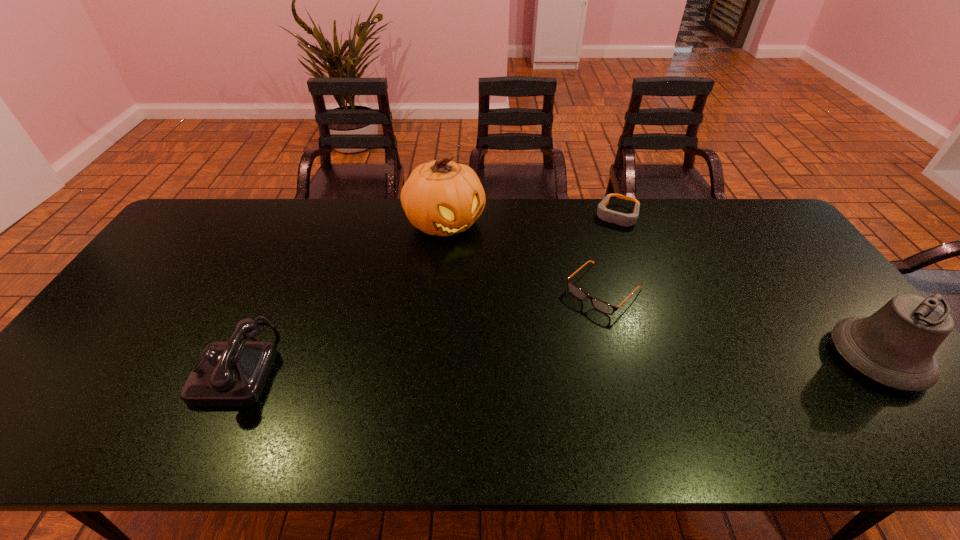
What are the coordinates of `free space on the desktop that is between the telephone and the rightmost object and is positioned on the front-facing side of the spectacles` in the screenshot? It's located at (531, 361).

Where is `vacant spot on the desktop that is between the telephone and the fourth shortest object and is positioned on the front face of the pumpkin`? vacant spot on the desktop that is between the telephone and the fourth shortest object and is positioned on the front face of the pumpkin is located at coordinates (575, 360).

The width and height of the screenshot is (960, 540). What are the coordinates of `free space on the desktop that is between the telephone and the bell and is positioned on the front and back of the goggles` in the screenshot? It's located at (549, 361).